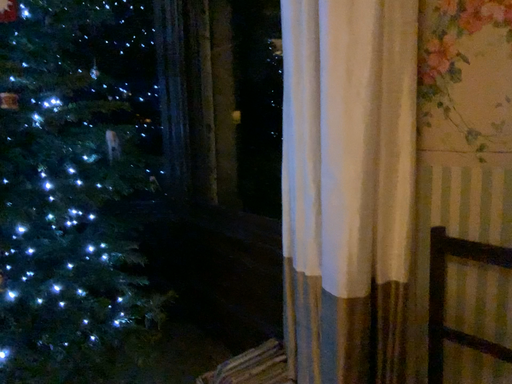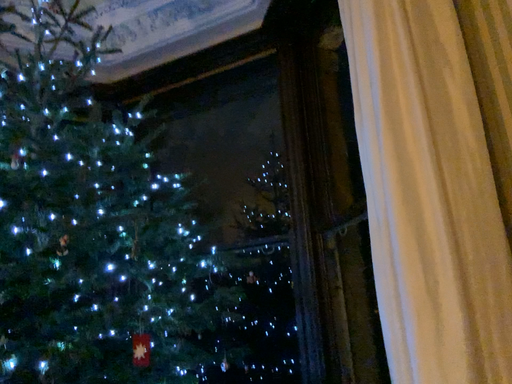
Question: Which way did the camera rotate in the video?

Choices:
 (A) rotated upward
 (B) rotated downward

Answer: (A)